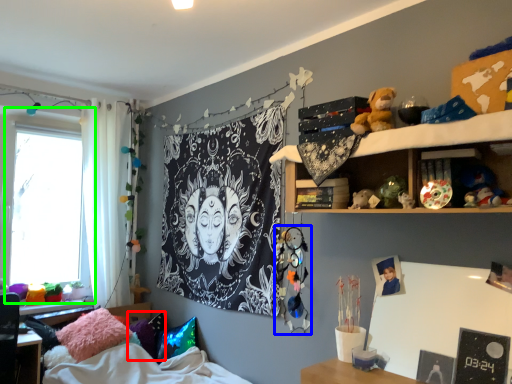
Question: Estimate the real-world distances between objects in this image. Which object is closer to pillow (highlighted by a red box), toy (highlighted by a blue box) or window (highlighted by a green box)?

Choices:
 (A) toy
 (B) window

Answer: (B)